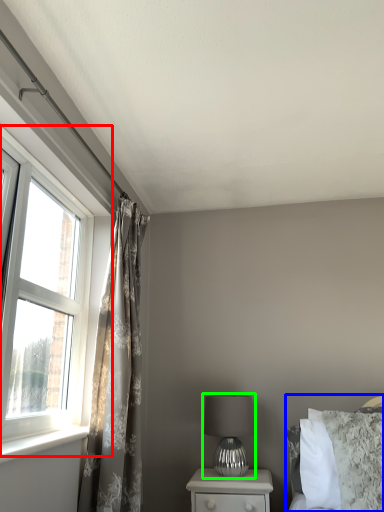
Question: Estimate the real-world distances between objects in this image. Which object is closer to window (highlighted by a red box), bed (highlighted by a blue box) or table lamp (highlighted by a green box)?

Choices:
 (A) bed
 (B) table lamp

Answer: (B)